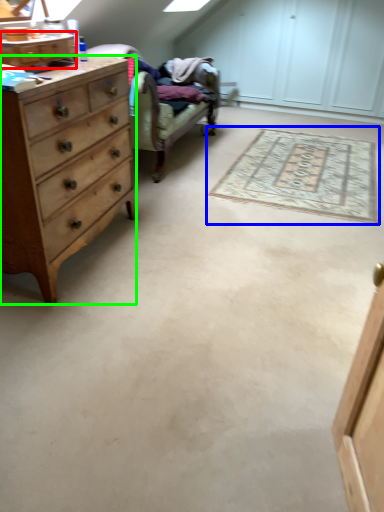
Question: Based on their relative distances, which object is farther from cabinetry (highlighted by a red box)? Choose from mat (highlighted by a blue box) and chest of drawers (highlighted by a green box).

Choices:
 (A) mat
 (B) chest of drawers

Answer: (A)